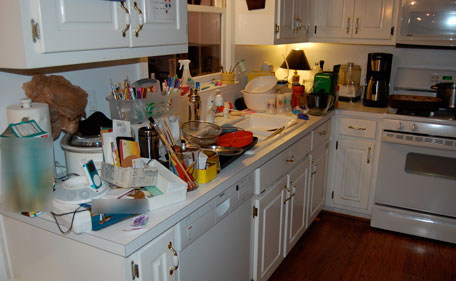
This screenshot has height=281, width=456. Find the location of `cabinet door below counter`. cabinet door below counter is located at coordinates [x=345, y=180], [x=318, y=188], [x=296, y=194], [x=263, y=218], [x=155, y=274].